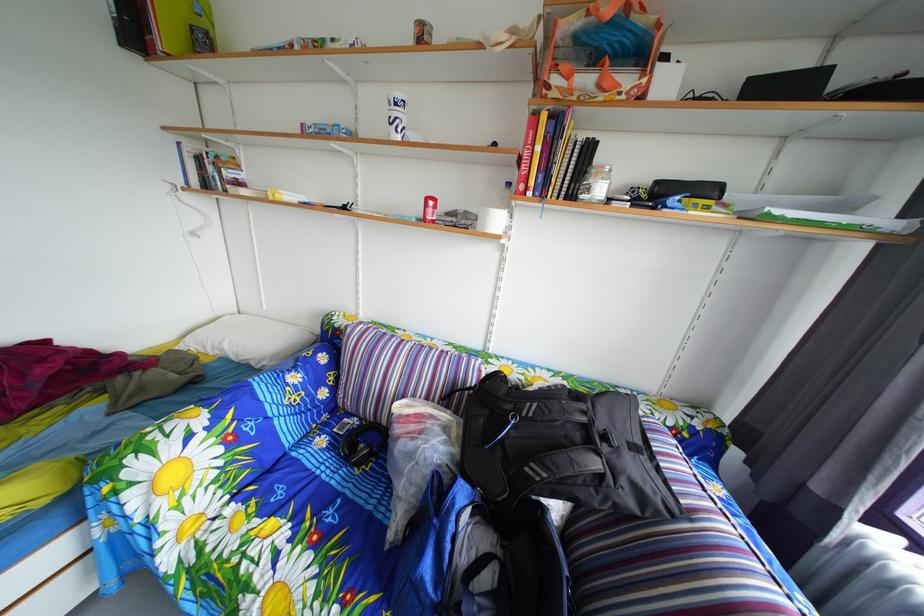
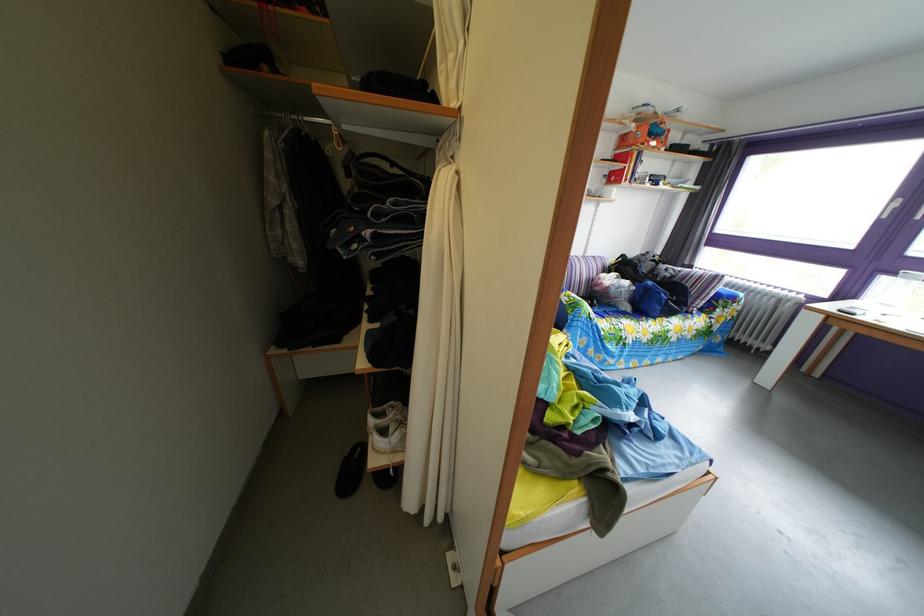
Locate, in the second image, the point that corresponds to pixel 604 70 in the first image.

(661, 144)